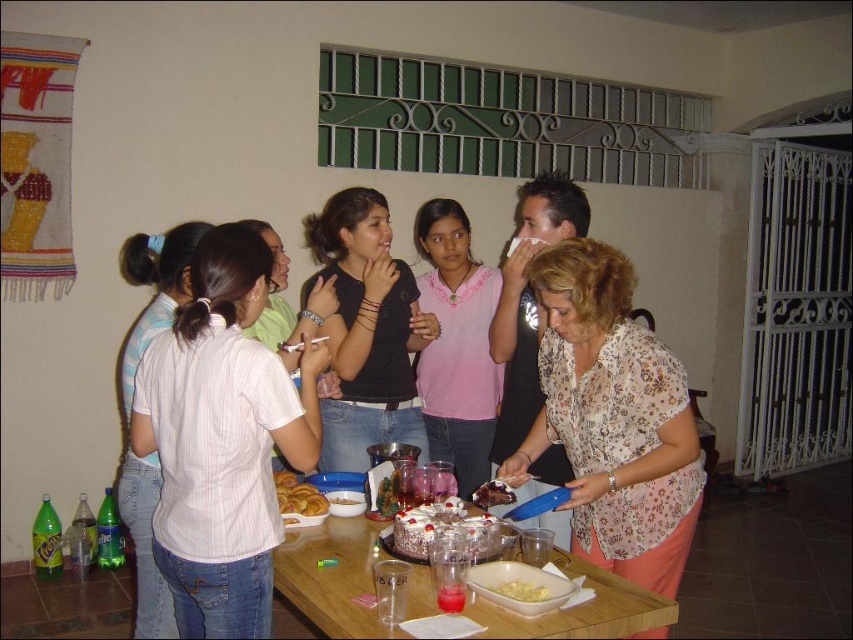
Does black matte shirt at center appear over white glossy cake at center?

Yes, black matte shirt at center is above white glossy cake at center.

Is point (355, 291) closer to camera compared to point (450, 497)?

No.

I want to click on black matte shirt at center, so 366,330.

Is matte white cake at center bigger than white frosted cake at center?

Yes.

Does point (509, 376) lie behind point (335, 499)?

Yes, point (509, 376) is behind point (335, 499).

What do you see at coordinates (593, 394) in the screenshot? I see `matte white cake at center` at bounding box center [593, 394].

Locate an element on the screen. matte white cake at center is located at coordinates (593, 394).

Who is positioned more to the right, white striped shirt at left or golden brown doughnut at center?

Positioned to the right is golden brown doughnut at center.

In the scene shown: Is white striped shirt at left bigger than golden brown doughnut at center?

Yes, white striped shirt at left is bigger than golden brown doughnut at center.

Identify the location of white striped shirt at left. The height and width of the screenshot is (640, 853). (155, 291).